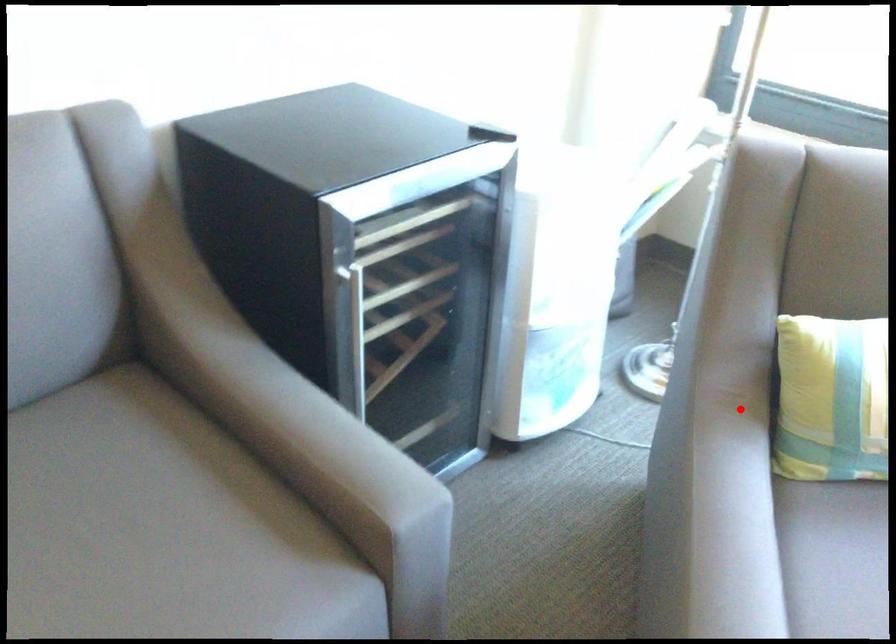
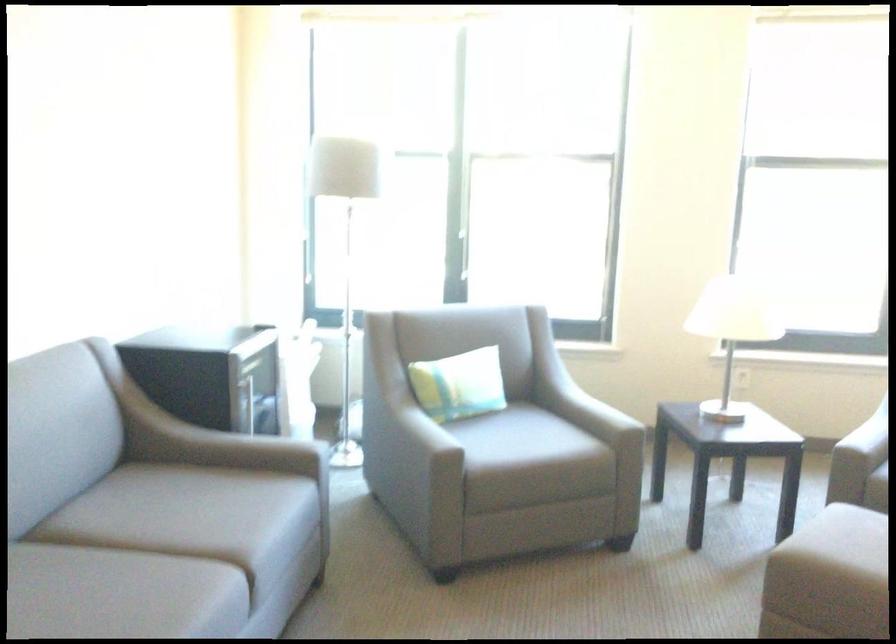
Question: A red point is marked in image1. In image2, is the corresponding 3D point closer to the camera or farther? Reply with the corresponding letter.

Choices:
 (A) The corresponding 3D point is closer.
 (B) The corresponding 3D point is farther.

Answer: (B)